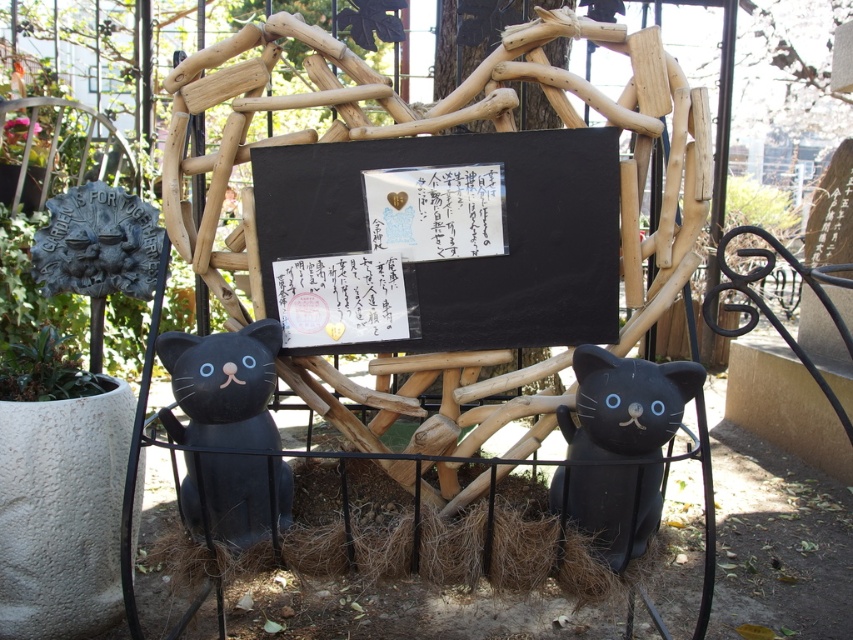
Does black matte/blackboard at center appear on the left side of matte black cat at lower right?

Indeed, black matte/blackboard at center is positioned on the left side of matte black cat at lower right.

Is black matte/blackboard at center above matte black cat at lower right?

Yes.

Who is more forward, (569,202) or (640,552)?

Point (640,552) is in front.

Locate an element on the screen. black matte/blackboard at center is located at coordinates (467, 259).

Between point (595, 200) and point (251, 332), which one is positioned in front?

Point (251, 332)

Is point (605, 209) behind point (212, 513)?

That is True.

Does point (450, 323) come behind point (193, 385)?

Yes, point (450, 323) is behind point (193, 385).

The width and height of the screenshot is (853, 640). In order to click on black matte/blackboard at center in this screenshot , I will do `click(467, 259)`.

Who is shorter, matte black cat at left or green leafy plant at lower left?

With less height is green leafy plant at lower left.

Can you confirm if matte black cat at left is shorter than green leafy plant at lower left?

No, matte black cat at left is not shorter than green leafy plant at lower left.

The width and height of the screenshot is (853, 640). What do you see at coordinates (222, 385) in the screenshot?
I see `matte black cat at left` at bounding box center [222, 385].

I want to click on matte black cat at left, so click(222, 385).